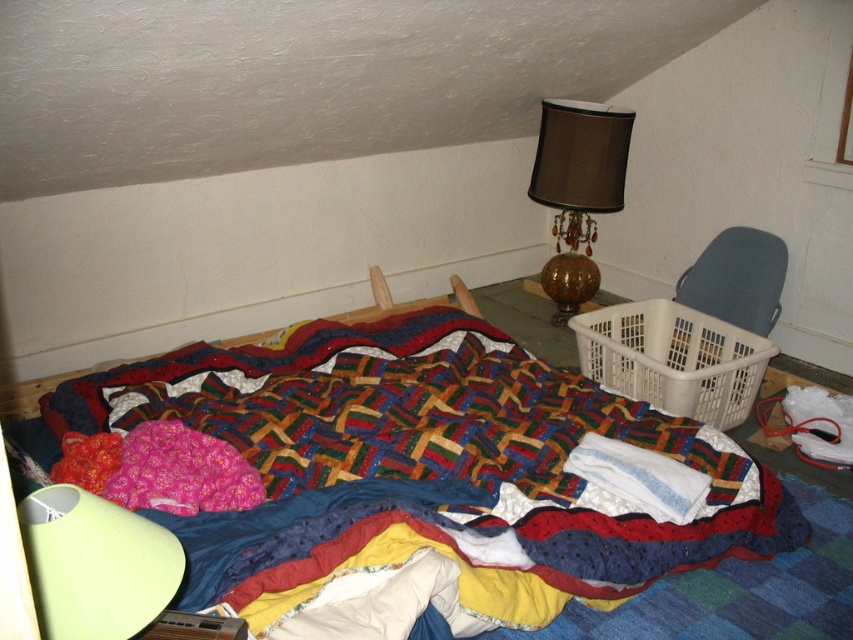
You are a delivery person who needs to place a package between the multicolored quilt at center and the gray plastic laundry basket at right. Can you fit the package if it measures 4 feet in length?

The distance between the multicolored quilt at center and the gray plastic laundry basket at right is 4.13 feet, so yes, the package can fit as it is shorter than the available space.

You are standing in the bedroom and want to place a small decorative item exactly at the point labeled as point (426, 467). According to the image, where should you place it?

The point (426, 467) is on the multicolored quilt at center, so you should place the item on the multicolored quilt at center.